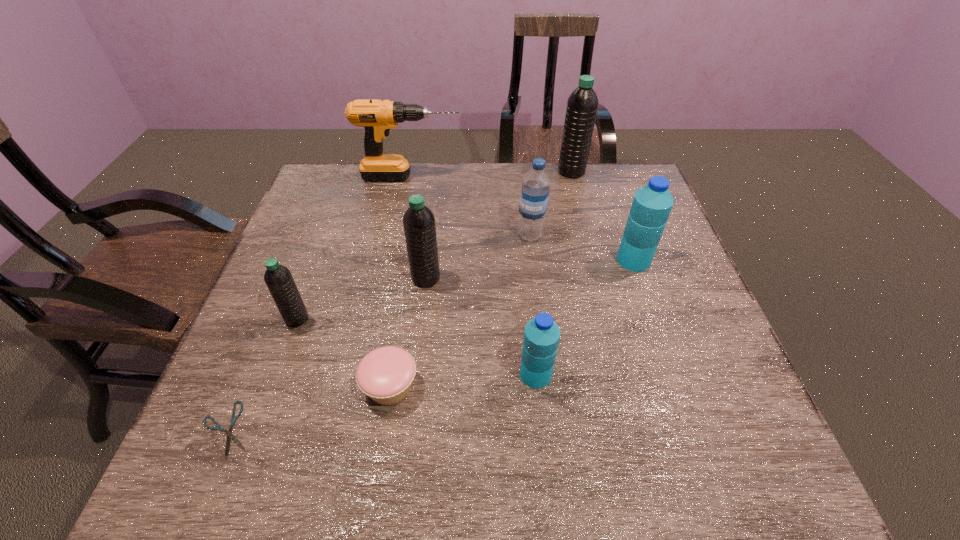
Locate which object ranks fifth in proximity to the nearest water bottle. Please provide its 2D coordinates. Your answer should be formatted as a tuple, i.e. [(x, y)], where the tuple contains the x and y coordinates of a point satisfying the conditions above.

[(278, 278)]

Select which water bottle appears as the closest to the shears. Please provide its 2D coordinates. Your answer should be formatted as a tuple, i.e. [(x, y)], where the tuple contains the x and y coordinates of a point satisfying the conditions above.

[(278, 278)]

Image resolution: width=960 pixels, height=540 pixels. I want to click on water bottle that is the third closest to the second shortest object, so click(419, 225).

You are a GUI agent. You are given a task and a screenshot of the screen. Output one action in this format:
    pyautogui.click(x=<x>, y=<y>)
    Task: Click on the black water bottle that is the second nearest to the black shears
    The image size is (960, 540).
    Given the screenshot: What is the action you would take?
    pyautogui.click(x=419, y=225)

Locate an element on the screen. This screenshot has width=960, height=540. black water bottle that is the nearest to the third farthest object is located at coordinates (419, 225).

The width and height of the screenshot is (960, 540). I want to click on blue water bottle identified as the closest to the seventh nearest object, so click(x=652, y=204).

At what (x,y) coordinates should I click in order to perform the action: click on blue water bottle that is the closest one to the rightmost object. Please return your answer as a coordinate pair (x, y). The width and height of the screenshot is (960, 540). Looking at the image, I should click on (535, 190).

The height and width of the screenshot is (540, 960). In order to click on free space that satisfies the following two spatial constraints: 1. on the back side of the cupcake; 2. at the tip of the drill in this screenshot , I will do `click(423, 177)`.

Find the location of a particular element. free space that satisfies the following two spatial constraints: 1. at the tip of the pink cupcake; 2. on the right side of the drill is located at coordinates (370, 386).